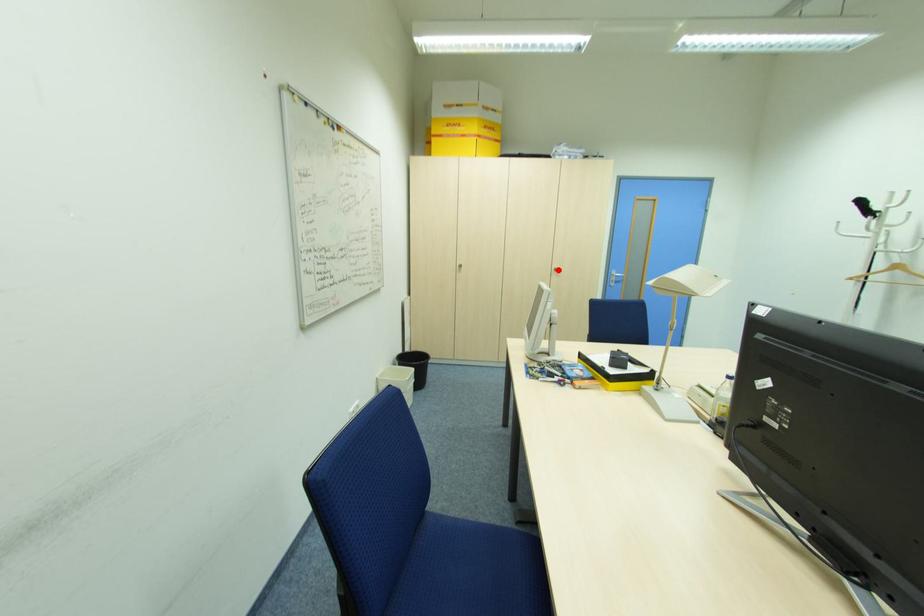
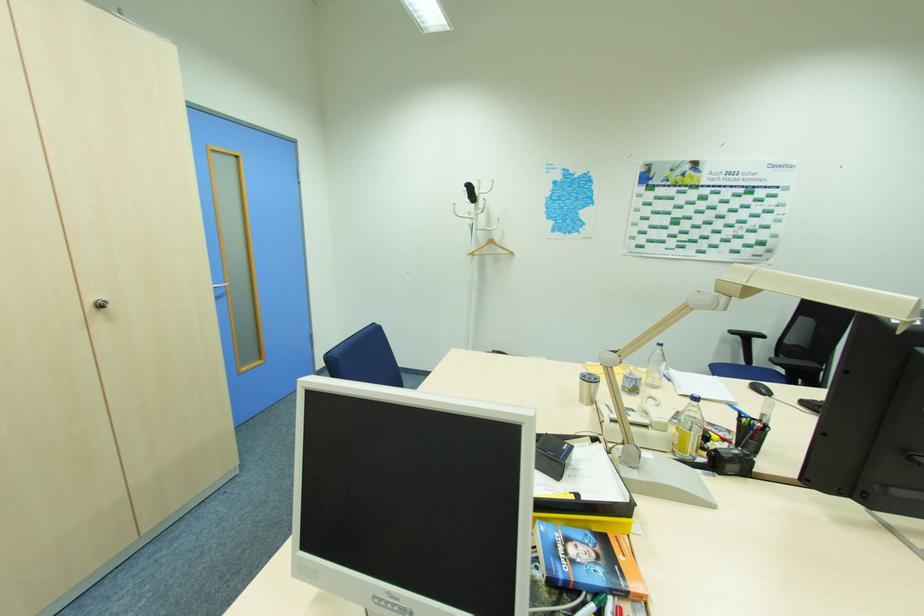
In the second image, find the point that corresponds to the highlighted location in the first image.

(103, 306)